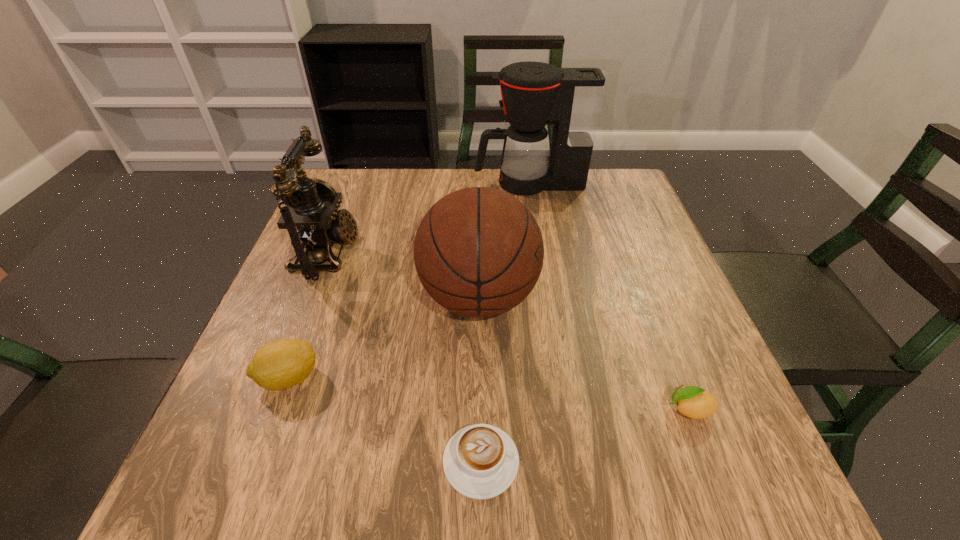
Where is `coffee maker`? This screenshot has width=960, height=540. coffee maker is located at coordinates (533, 93).

Locate an element on the screen. The height and width of the screenshot is (540, 960). telephone is located at coordinates (310, 216).

Find the location of `basketball`. basketball is located at coordinates (478, 252).

This screenshot has width=960, height=540. Find the location of `the taller lemon`. the taller lemon is located at coordinates (282, 364).

The height and width of the screenshot is (540, 960). I want to click on the third shortest object, so click(x=282, y=364).

The image size is (960, 540). Identify the location of the shorter lemon. (694, 402).

You are a GUI agent. You are given a task and a screenshot of the screen. Output one action in this format:
    pyautogui.click(x=<x>, y=<y>)
    Task: Click on the right lemon
    
    Given the screenshot: What is the action you would take?
    (x=694, y=402)

Where is `the nearest object`? the nearest object is located at coordinates (480, 461).

Where is `free region located pour from the carafe of the coffee maker`? Image resolution: width=960 pixels, height=540 pixels. free region located pour from the carafe of the coffee maker is located at coordinates (344, 183).

At what (x,y) coordinates should I click in order to perform the action: click on vacant space located 0.380m pour from the carafe of the coffee maker. Please return your answer as a coordinate pair (x, y). The width and height of the screenshot is (960, 540). Looking at the image, I should click on (344, 183).